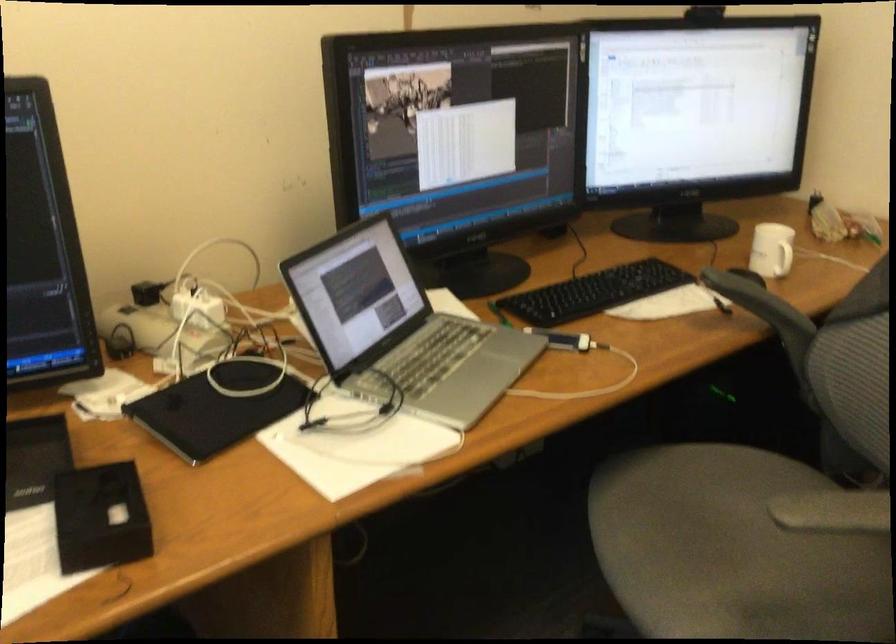
Where would you lift the black webcam? Please return your answer as a coordinate pair (x, y).

(694, 117)